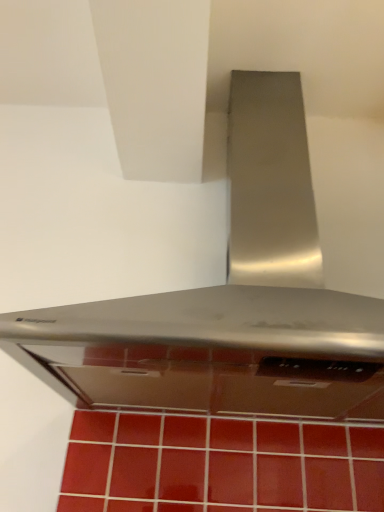
The image size is (384, 512). Describe the element at coordinates (233, 301) in the screenshot. I see `stainless steel range hood at center` at that location.

Find the location of a particular element. Image resolution: width=384 pixels, height=512 pixels. stainless steel range hood at center is located at coordinates (233, 301).

Find the location of `stainless steel range hood at center`. stainless steel range hood at center is located at coordinates (233, 301).